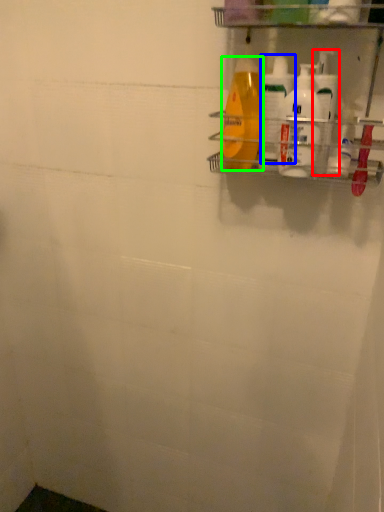
Question: Considering the real-world distances, which object is closest to cleaning product (highlighted by a red box)? cleaning product (highlighted by a blue box) or cleaning product (highlighted by a green box).

Choices:
 (A) cleaning product
 (B) cleaning product

Answer: (A)